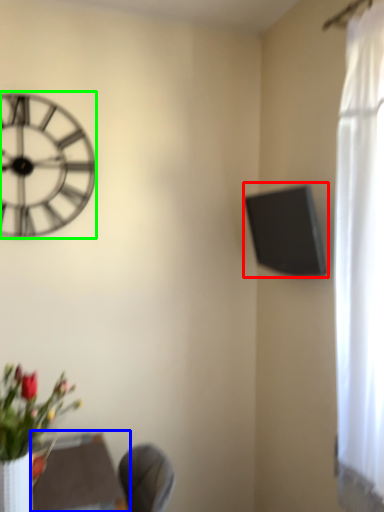
Question: Which object is the closest to the window screen (highlighted by a red box)? Choose among these: round table (highlighted by a blue box) or wall clock (highlighted by a green box).

Choices:
 (A) round table
 (B) wall clock

Answer: (B)